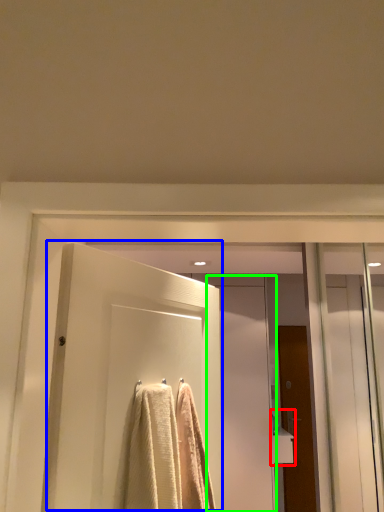
Question: Which object is the closest to the sink (highlighted by a red box)? Choose among these: door (highlighted by a blue box) or screen door (highlighted by a green box).

Choices:
 (A) door
 (B) screen door

Answer: (B)